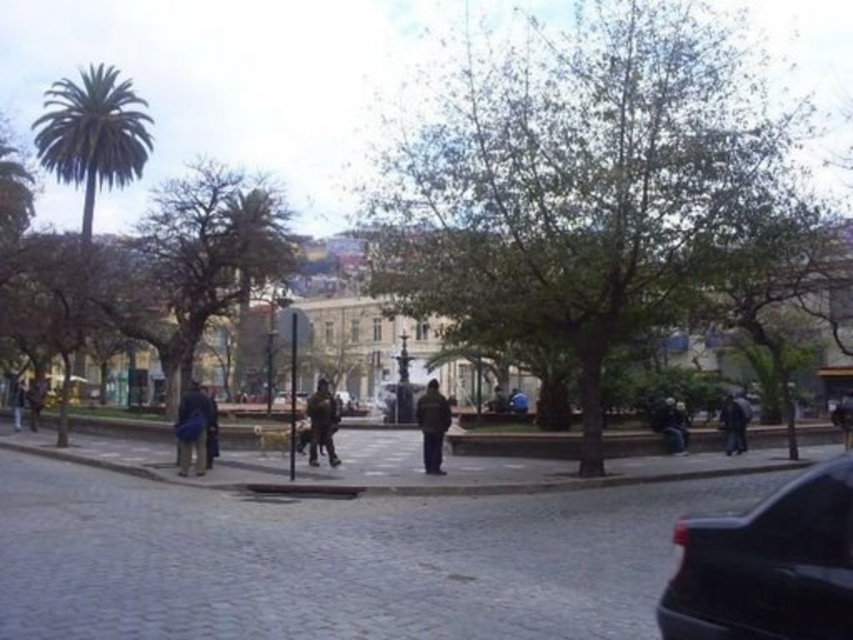
Based on the photo, you are a photographer trying to capture the shiny black car at lower right and the dark brown leather jacket at center in the same frame. Which object should you zoom in on to ensure both are visible without cropping?

The shiny black car at lower right is smaller than the dark brown leather jacket at center. To include both in the frame without cropping, you should zoom out slightly so that the smaller shiny black car at lower right is fully visible while still keeping the larger dark brown leather jacket at center in the shot.

You are standing at the center of the plaza and want to hail a taxi. The taxi you need is the shiny black car at lower right. According to the coordinates provided, in which direction should you walk to reach it?

The shiny black car at lower right is located at coordinate point (767, 564). Since you are at the center of the plaza, you should walk towards the lower right direction to reach it.